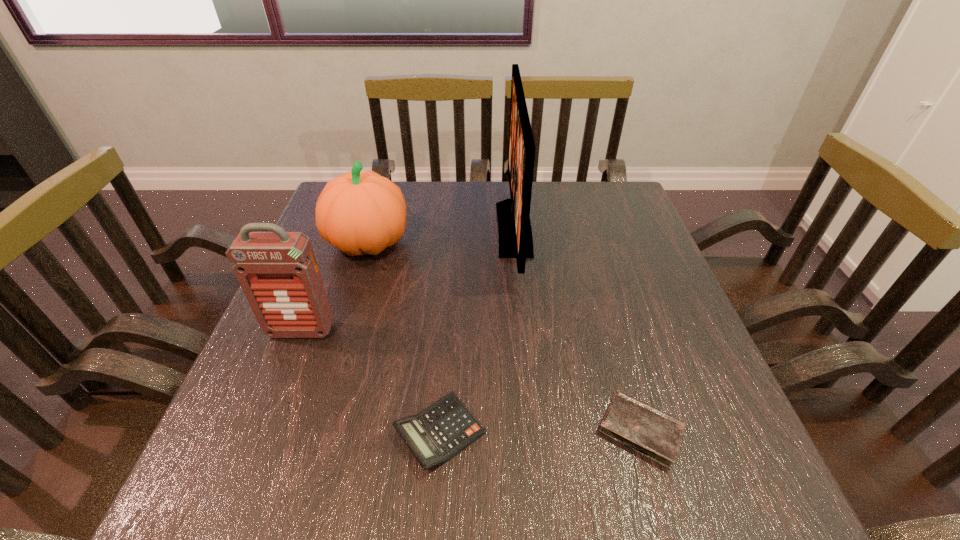
You are a GUI agent. You are given a task and a screenshot of the screen. Output one action in this format:
    pyautogui.click(x=<x>, y=<y>)
    Task: Click on the vacant area that lies between the third object from right to left and the first-aid kit
    The image size is (960, 540).
    Given the screenshot: What is the action you would take?
    pyautogui.click(x=371, y=382)

The height and width of the screenshot is (540, 960). Identify the location of free space between the rightmost object and the tallest object. 578,330.

This screenshot has height=540, width=960. I want to click on free space between the third tallest object and the second shortest object, so click(404, 338).

Image resolution: width=960 pixels, height=540 pixels. I want to click on blank region between the rightmost object and the second tallest object, so click(471, 381).

The height and width of the screenshot is (540, 960). Identify the location of free space between the calculator and the diary. (540, 431).

Where is `free space between the shortest object and the monitor`? free space between the shortest object and the monitor is located at coordinates (578, 330).

You are a GUI agent. You are given a task and a screenshot of the screen. Output one action in this format:
    pyautogui.click(x=<x>, y=<y>)
    Task: Click on the free space between the second tallest object and the fourth object from left to right
    This screenshot has width=960, height=540.
    Given the screenshot: What is the action you would take?
    pyautogui.click(x=408, y=280)

I want to click on free space between the third tallest object and the diary, so click(x=505, y=336).

Where is `free space between the pumpkin and the third object from right to left`? This screenshot has height=540, width=960. free space between the pumpkin and the third object from right to left is located at coordinates (404, 338).

At what (x,y) coordinates should I click in order to perform the action: click on object that is the second closest to the diary. Please return your answer as a coordinate pair (x, y). Looking at the image, I should click on (514, 227).